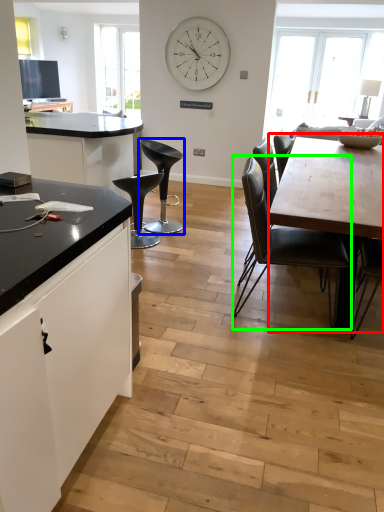
Question: Based on their relative distances, which object is nearer to round table (highlighted by a red box)? Choose from chair (highlighted by a blue box) and chair (highlighted by a green box).

Choices:
 (A) chair
 (B) chair

Answer: (B)